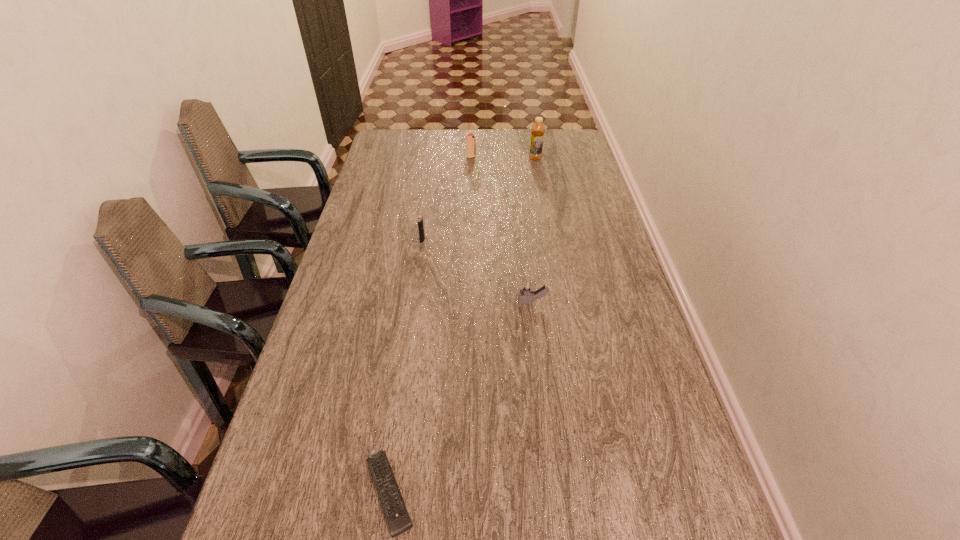
What are the coordinates of `vacant space situated on the back of the rightmost object` in the screenshot? It's located at (534, 147).

This screenshot has width=960, height=540. In order to click on free region located 0.090m on the back of the second igniter from left to right in this screenshot , I will do `click(471, 145)`.

Locate an element on the screen. This screenshot has width=960, height=540. vacant point located 0.100m on the back of the leftmost igniter is located at coordinates (425, 219).

At what (x,y) coordinates should I click in order to perform the action: click on vacant space situated 0.350m on the front of the second nearest object. Please return your answer as a coordinate pair (x, y). The height and width of the screenshot is (540, 960). Looking at the image, I should click on (547, 426).

Identify the location of vacant space located 0.380m on the back of the remote control. (415, 316).

Locate an element on the screen. Image resolution: width=960 pixels, height=540 pixels. bottle that is at the far edge is located at coordinates (538, 129).

You are a GUI agent. You are given a task and a screenshot of the screen. Output one action in this format:
    pyautogui.click(x=<x>, y=<y>)
    Task: Click on the igniter located at the far edge
    The width and height of the screenshot is (960, 540).
    Given the screenshot: What is the action you would take?
    pyautogui.click(x=470, y=139)

Image resolution: width=960 pixels, height=540 pixels. In order to click on vacant space at the far edge of the desktop in this screenshot , I will do (477, 130).

Image resolution: width=960 pixels, height=540 pixels. Identify the location of free spot at the left edge of the desktop. (378, 251).

The height and width of the screenshot is (540, 960). Identify the location of free space at the right edge of the desktop. (557, 188).